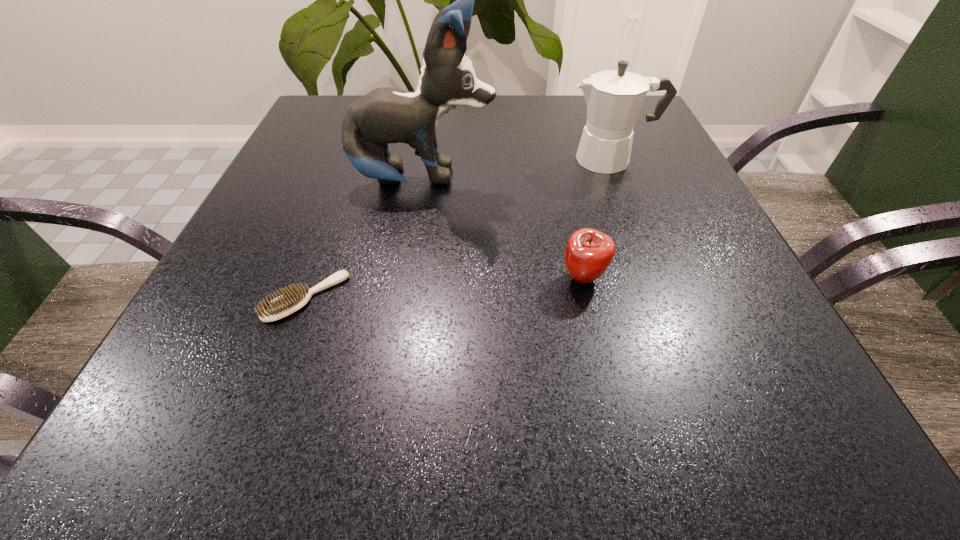
Locate an element on the screen. This screenshot has width=960, height=540. empty space that is in between the second shortest object and the coffeepot is located at coordinates point(597,219).

This screenshot has width=960, height=540. I want to click on empty space between the third tallest object and the tallest object, so click(503, 228).

Where is `empty location between the shortest object and the coffeepot`? The image size is (960, 540). empty location between the shortest object and the coffeepot is located at coordinates (459, 228).

This screenshot has height=540, width=960. In order to click on vacant area between the shortest object and the tallest object in this screenshot , I will do `click(365, 239)`.

Locate an element on the screen. free spot between the coffeepot and the shortest object is located at coordinates (459, 228).

Find the location of a particular element. The height and width of the screenshot is (540, 960). blank region between the apple and the shortest object is located at coordinates (444, 288).

I want to click on vacant region between the third shortest object and the second shortest object, so click(597, 219).

At what (x,y) coordinates should I click in order to perform the action: click on free space between the tallest object and the scrubbing brush. Please return your answer as a coordinate pair (x, y). This screenshot has width=960, height=540. Looking at the image, I should click on (365, 239).

Locate which object ranks third in proximity to the apple. Please provide its 2D coordinates. Your answer should be formatted as a tuple, i.e. [(x, y)], where the tuple contains the x and y coordinates of a point satisfying the conditions above.

[(292, 299)]

Locate an element on the screen. the closest object to the puppy is located at coordinates (614, 98).